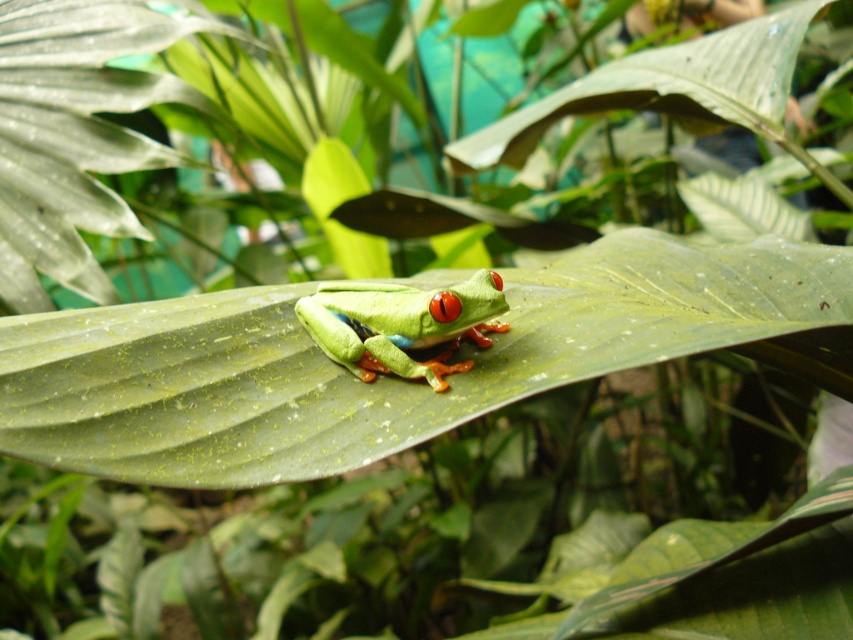
Is point (428, 429) behind point (485, 305)?

No, it is not.

Is point (263, 444) more distant than point (444, 371)?

No, (263, 444) is closer to viewer.

Find the location of `green matte leaf at center`. green matte leaf at center is located at coordinates (379, 376).